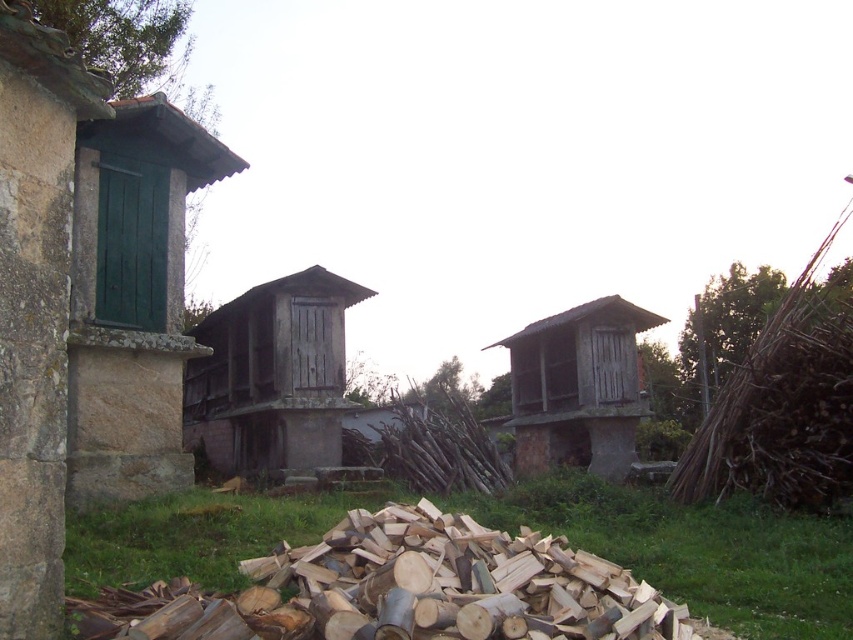
Question: Is weathered wood hut at center further to camera compared to wooden hut at center?

Choices:
 (A) yes
 (B) no

Answer: (B)

Question: Can you confirm if green grass at lower center is wider than wooden hut at center?

Choices:
 (A) no
 (B) yes

Answer: (B)

Question: Can you confirm if green stone hut at left is wider than weathered wood hut at center?

Choices:
 (A) yes
 (B) no

Answer: (B)

Question: Among these objects, which one is nearest to the camera?

Choices:
 (A) weathered wood hut at center
 (B) green stone hut at left

Answer: (B)

Question: Which point is farther from the camera taking this photo?

Choices:
 (A) (833, 605)
 (B) (144, 412)

Answer: (B)

Question: Which object appears farthest from the camera in this image?

Choices:
 (A) wooden hut at center
 (B) green grass at lower center
 (C) weathered wood hut at center
 (D) green stone hut at left

Answer: (A)